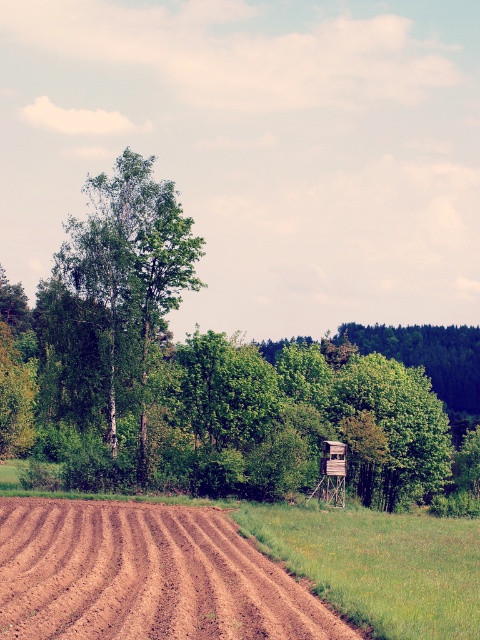
Can you confirm if brown soil at lower left is positioned above green leafy tree at center?

Actually, brown soil at lower left is below green leafy tree at center.

In the scene shown: Can you confirm if brown soil at lower left is thinner than green leafy tree at center?

Indeed, brown soil at lower left has a lesser width compared to green leafy tree at center.

Between point (51, 538) and point (66, 392), which one is positioned behind?

Point (66, 392)

This screenshot has width=480, height=640. Find the location of `brown soil at lower left`. brown soil at lower left is located at coordinates (144, 577).